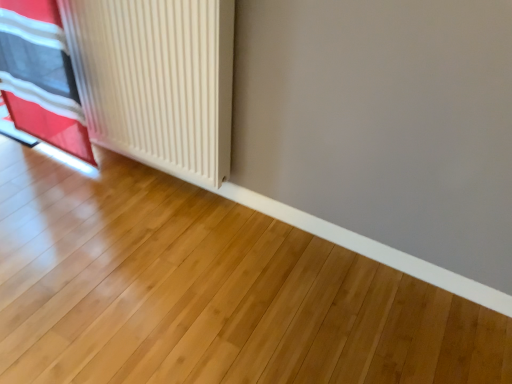
Question: From a real-world perspective, is red fabric curtain at left positioned above or below white matte radiator at left?

Choices:
 (A) above
 (B) below

Answer: (B)

Question: Is red fabric curtain at left wider or thinner than white matte radiator at left?

Choices:
 (A) thin
 (B) wide

Answer: (A)

Question: Would you say red fabric curtain at left is to the left or to the right of white matte radiator at left in the picture?

Choices:
 (A) left
 (B) right

Answer: (A)

Question: Looking at the image, does white matte radiator at left seem bigger or smaller compared to red fabric curtain at left?

Choices:
 (A) small
 (B) big

Answer: (B)

Question: Considering the positions of white matte radiator at left and red fabric curtain at left in the image, is white matte radiator at left taller or shorter than red fabric curtain at left?

Choices:
 (A) tall
 (B) short

Answer: (B)

Question: Choose the correct answer: Is white matte radiator at left inside red fabric curtain at left or outside it?

Choices:
 (A) inside
 (B) outside

Answer: (B)

Question: From a real-world perspective, is white matte radiator at left above or below red fabric curtain at left?

Choices:
 (A) above
 (B) below

Answer: (A)